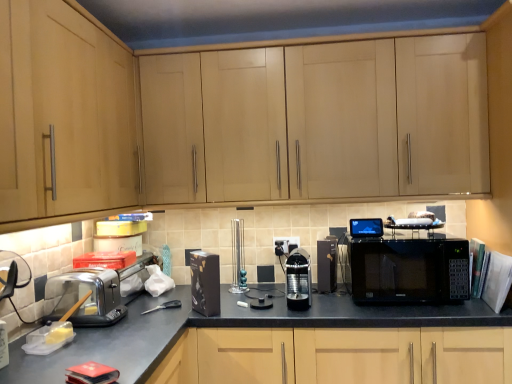
At what (x,y) coordinates should I click in order to perform the action: click on free space to the right of black matte box at center, marked as the 1th appliance in a left-to-right arrangement. Please return your answer as a coordinate pair (x, y). Image resolution: width=512 pixels, height=384 pixels. Looking at the image, I should click on (242, 314).